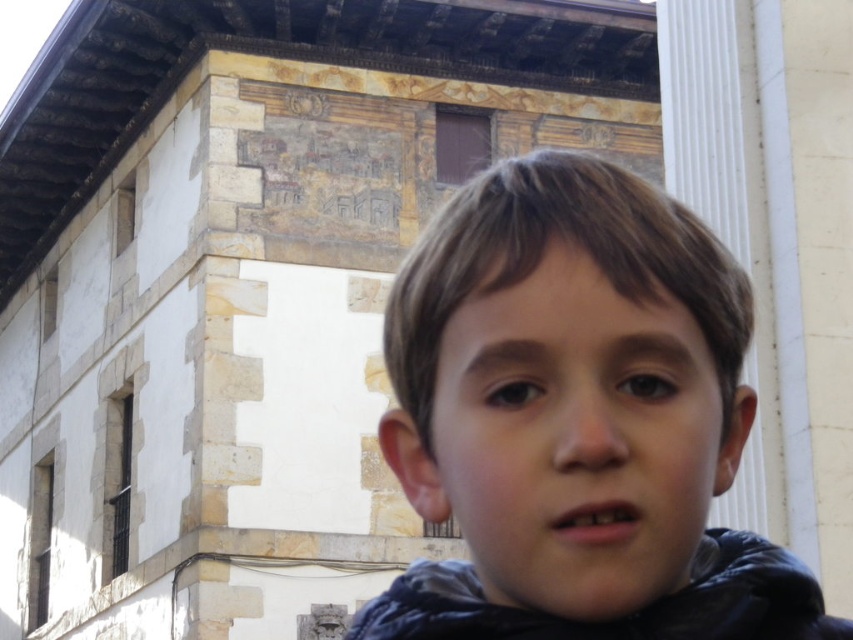
You are a photographer trying to capture both the dark blue fleece at center and the dark blue fleece jacket at lower right in the same frame. Given the distance between them, will you need to adjust your camera lens to a wider angle to include both objects?

The distance between the dark blue fleece at center and the dark blue fleece jacket at lower right is 6.37 feet. To capture both in the same frame, you would need to use a wider angle lens to accommodate the space between them.

Consider the image. You are a photographer trying to focus on the dark blue fleece at center and the dark blue fleece jacket at lower right. Which one should you adjust your camera lens to focus on first if you want to capture both in sharp detail?

You should focus on the dark blue fleece at center first because it is closer to the viewer than the dark blue fleece jacket at lower right, ensuring both will be in focus when using a shallow depth of field.